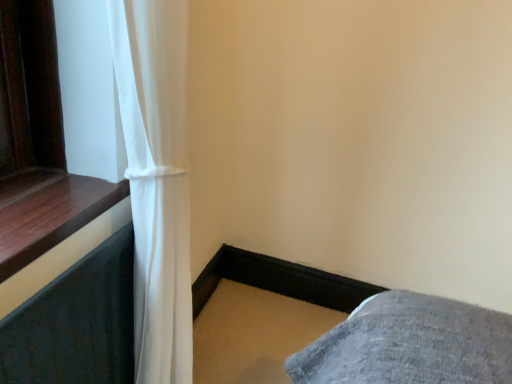
The height and width of the screenshot is (384, 512). What do you see at coordinates (49, 213) in the screenshot?
I see `wooden at left` at bounding box center [49, 213].

You are a GUI agent. You are given a task and a screenshot of the screen. Output one action in this format:
    pyautogui.click(x=<x>, y=<y>)
    Task: Click on the wooden at left
    
    Given the screenshot: What is the action you would take?
    pyautogui.click(x=49, y=213)

Find the location of a particular element. The image size is (512, 384). wooden at left is located at coordinates (49, 213).